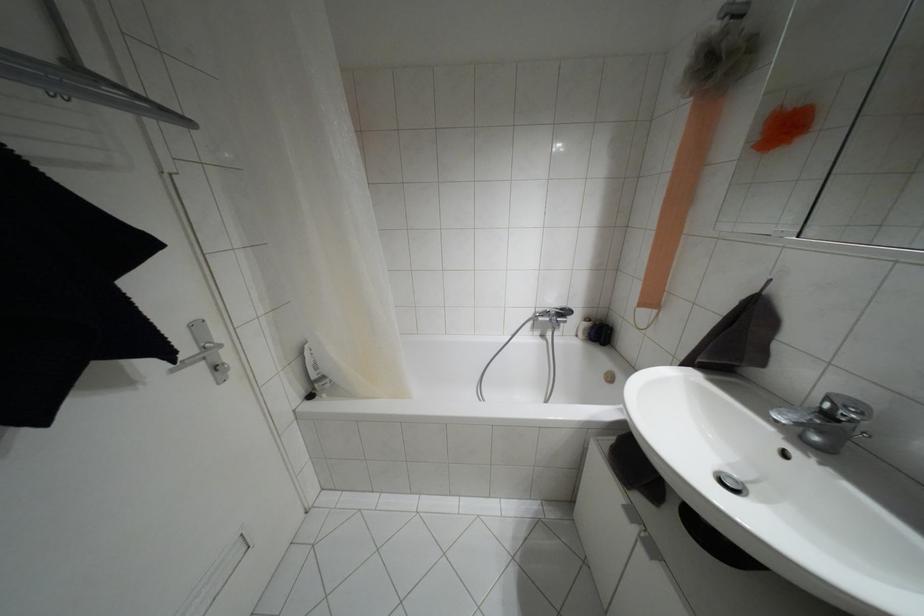
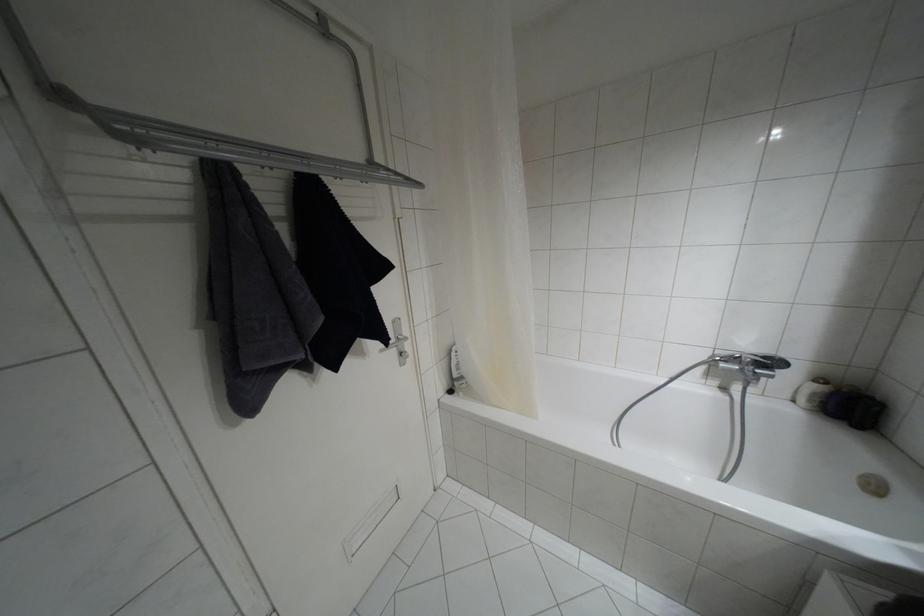
The point at (586, 318) is marked in the first image. Where is the corresponding point in the second image?

(820, 379)